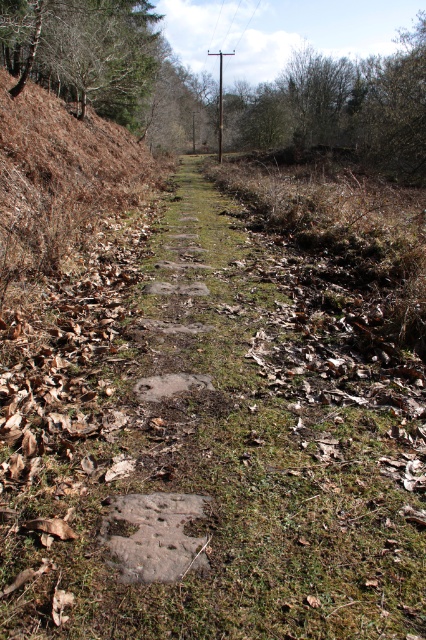
Question: Which point appears closest to the camera in this image?

Choices:
 (A) (221, 132)
 (B) (17, 17)

Answer: (B)

Question: From the image, what is the correct spatial relationship of brown leafy tree at upper center in relation to brown wooden telegraph pole at center?

Choices:
 (A) right
 (B) left

Answer: (A)

Question: Does brown leafy tree at upper center appear on the left side of brown wooden telegraph pole at center?

Choices:
 (A) yes
 (B) no

Answer: (B)

Question: Among these objects, which one is farthest from the camera?

Choices:
 (A) brown bark tree at upper left
 (B) brown wooden telegraph pole at center

Answer: (B)

Question: Is brown leafy tree at upper center smaller than brown bark tree at upper left?

Choices:
 (A) no
 (B) yes

Answer: (A)

Question: Based on their relative distances, which object is nearer to the brown bark tree at upper left?

Choices:
 (A) brown wooden telegraph pole at center
 (B) brown leafy tree at upper center

Answer: (B)